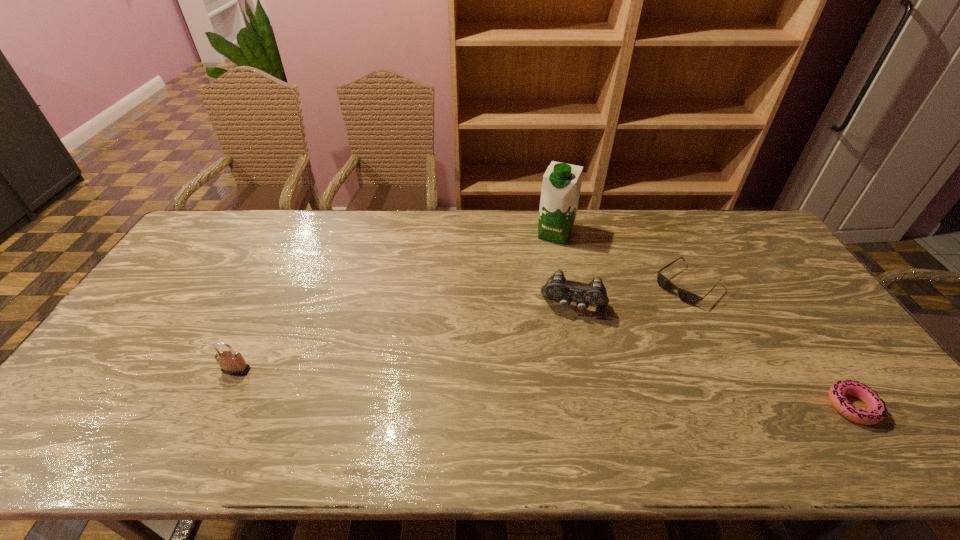
Identify the location of free spot that satisfies the following two spatial constraints: 1. on the front side of the control; 2. on the left side of the rightmost object. The width and height of the screenshot is (960, 540). (596, 406).

Locate an element on the screen. free location that satisfies the following two spatial constraints: 1. on the front side of the control; 2. on the left side of the nearest object is located at coordinates (596, 406).